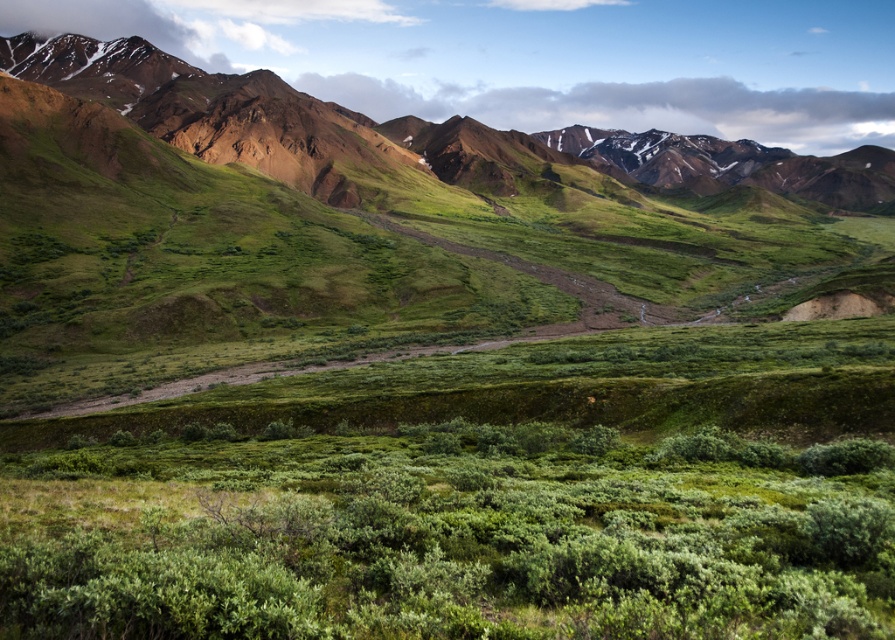
Question: Does green leafy shrubs at center have a larger size compared to rustic brown mountains at upper left?

Choices:
 (A) no
 (B) yes

Answer: (A)

Question: Does green leafy shrubs at center lie in front of rustic brown mountains at upper left?

Choices:
 (A) no
 (B) yes

Answer: (B)

Question: Which point appears farthest from the camera in this image?

Choices:
 (A) (95, 561)
 (B) (186, 112)

Answer: (B)

Question: Does green leafy shrubs at center appear under rustic brown mountains at upper left?

Choices:
 (A) no
 (B) yes

Answer: (B)